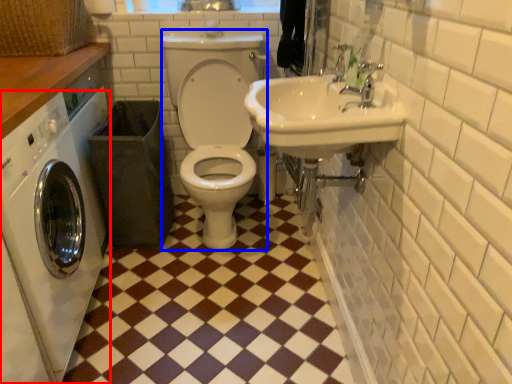
Question: Which of the following is the farthest to the observer, washing machine (highlighted by a red box) or squat (highlighted by a blue box)?

Choices:
 (A) washing machine
 (B) squat

Answer: (B)